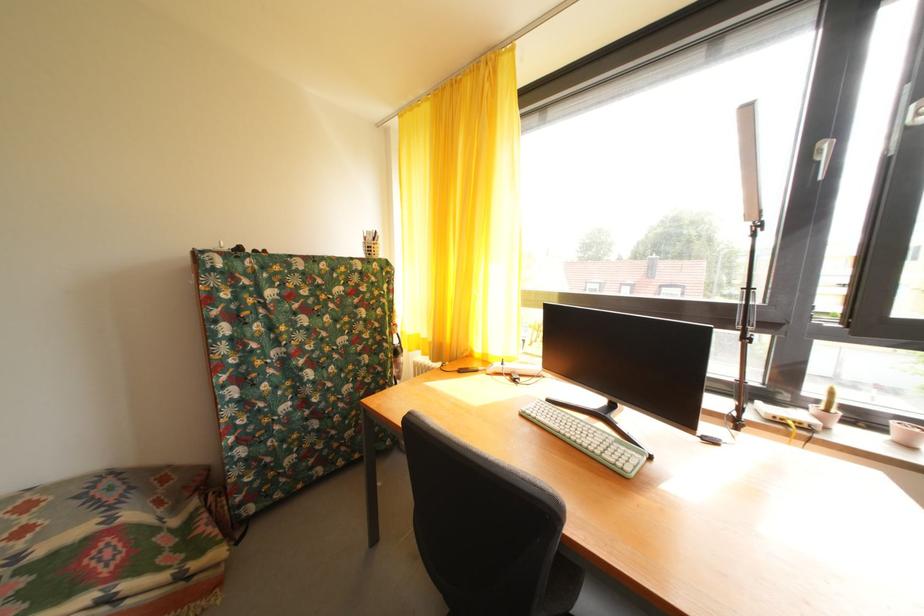
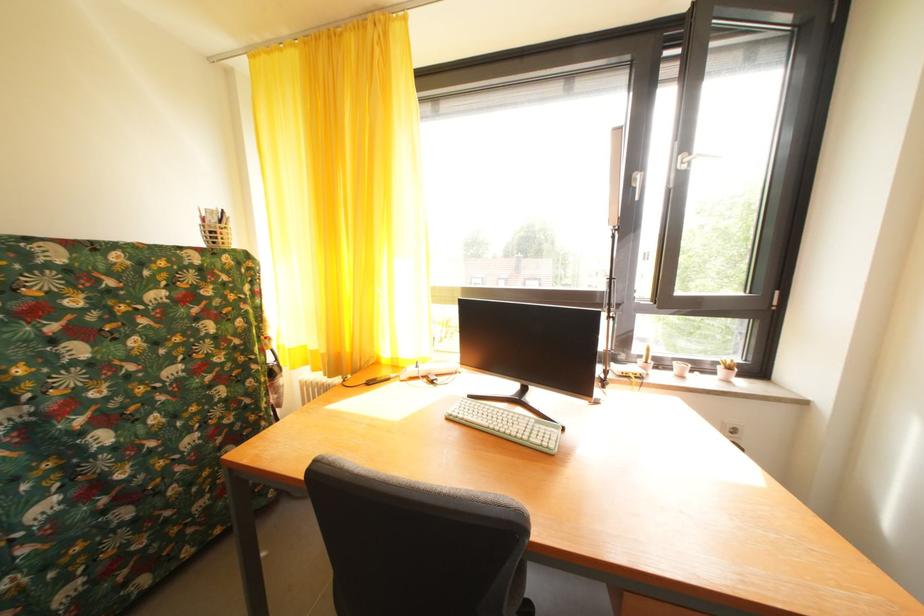
Find the pixel in the second image that matches point 557,407 in the first image.

(479, 402)